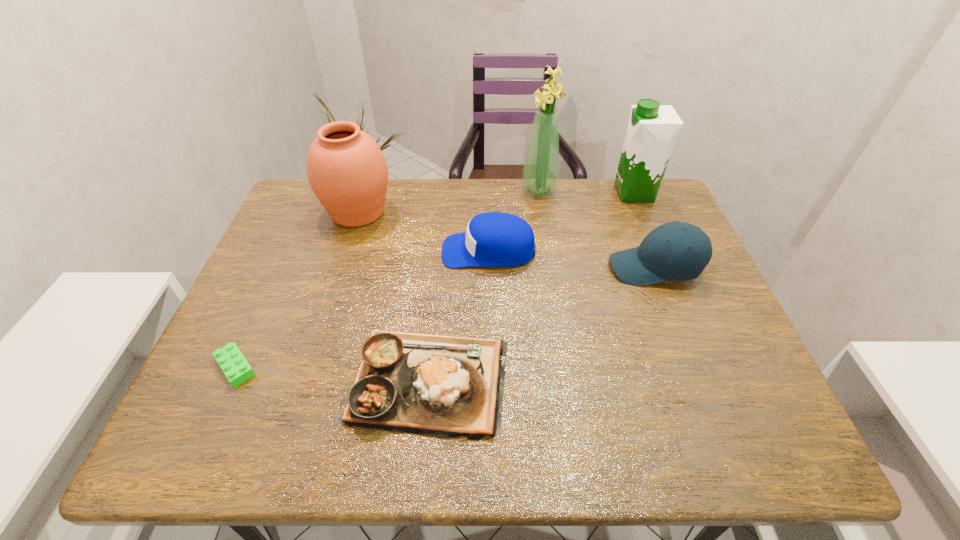
Find the location of `empty space between the taller baseball cap and the shortest object`. empty space between the taller baseball cap and the shortest object is located at coordinates (445, 318).

Where is `free point between the tallest object and the soya milk`? This screenshot has width=960, height=540. free point between the tallest object and the soya milk is located at coordinates (587, 192).

The height and width of the screenshot is (540, 960). I want to click on free space that is in between the sixth tallest object and the shorter baseball cap, so click(x=458, y=316).

This screenshot has width=960, height=540. Find the location of `free space between the urn and the bouquet`. free space between the urn and the bouquet is located at coordinates coord(448,201).

Image resolution: width=960 pixels, height=540 pixels. Identify the location of free space between the Lego and the bouquet. (387, 279).

Where is `empty space that is in between the sixth tallest object and the soya milk`? This screenshot has height=540, width=960. empty space that is in between the sixth tallest object and the soya milk is located at coordinates (531, 287).

Select which object is the third closest to the urn. Please provide its 2D coordinates. Your answer should be formatted as a tuple, i.e. [(x, y)], where the tuple contains the x and y coordinates of a point satisfying the conditions above.

[(234, 365)]

At what (x,y) coordinates should I click in order to perform the action: click on object that stands as the fourth closest to the soya milk. Please return your answer as a coordinate pair (x, y). The width and height of the screenshot is (960, 540). Looking at the image, I should click on (415, 383).

This screenshot has height=540, width=960. I want to click on free space that satisfies the following two spatial constraints: 1. on the front-facing side of the right baseball cap; 2. on the front side of the shortest object, so click(x=693, y=367).